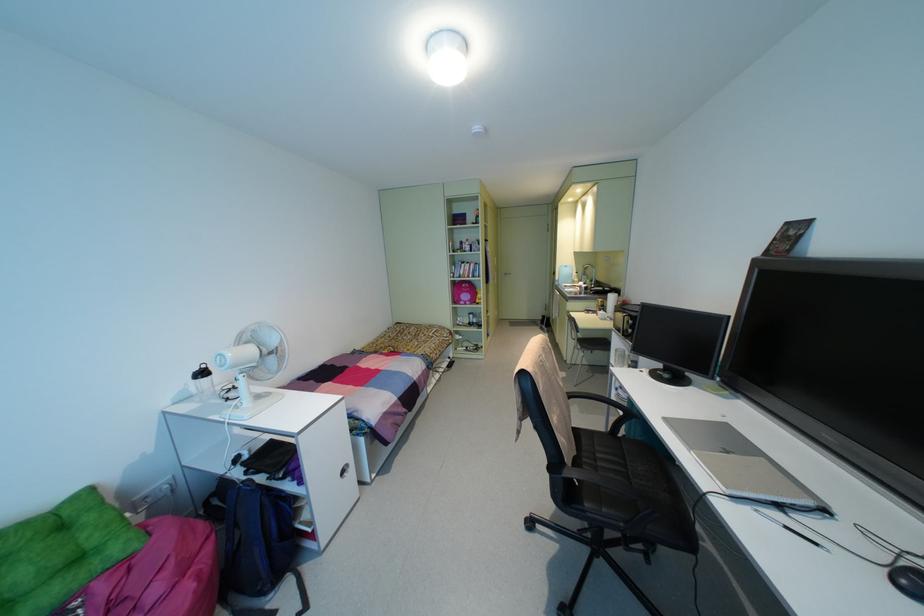
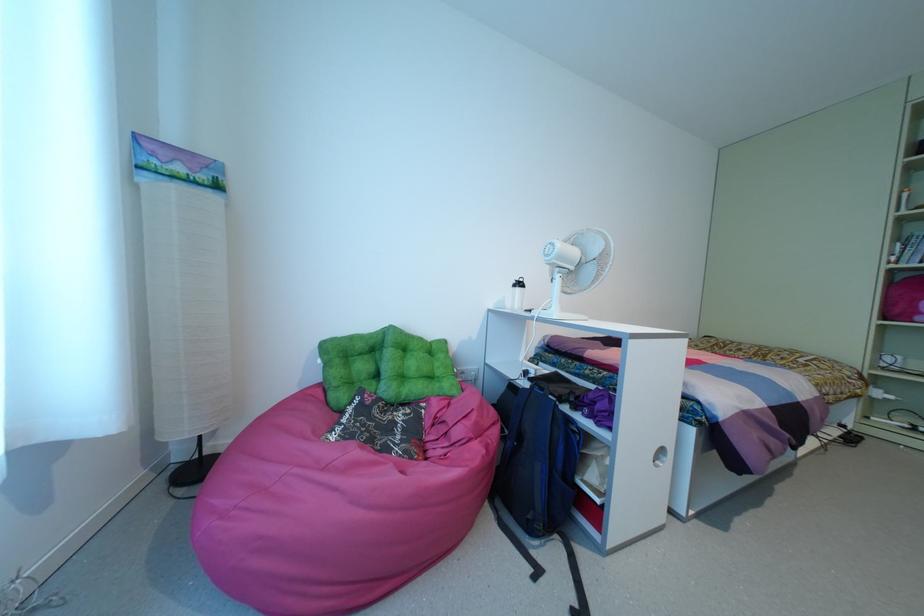
Locate, in the second image, the point that corresponds to (202,365) in the first image.

(520, 280)